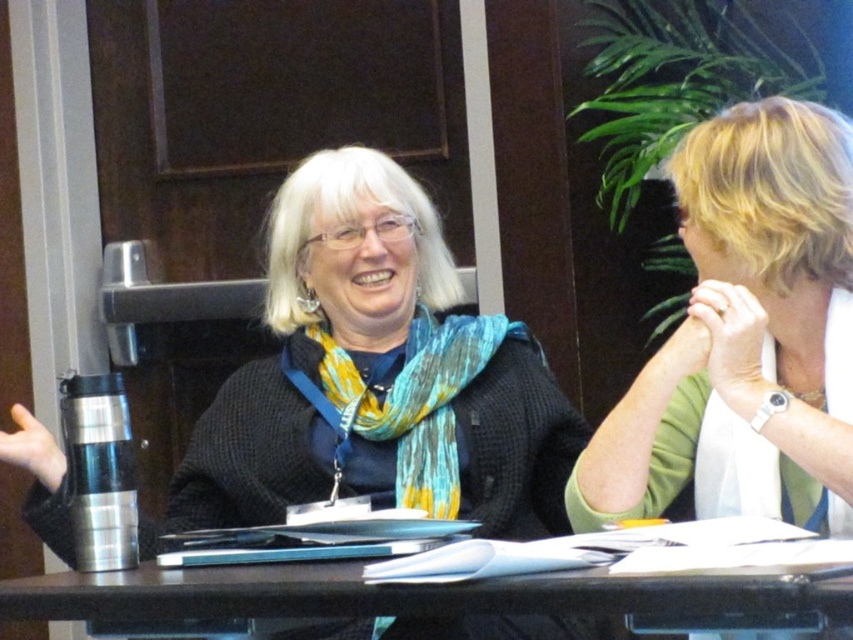
Question: Is black plastic table at center further to camera compared to blue and yellow woven scarf at center?

Choices:
 (A) no
 (B) yes

Answer: (A)

Question: Which object is the closest to the blue and yellow woven scarf at center?

Choices:
 (A) black plastic table at center
 (B) white fabric at upper right

Answer: (B)

Question: Which of the following is the closest to the observer?

Choices:
 (A) blue and yellow woven scarf at center
 (B) white fabric at upper right
 (C) black plastic table at center

Answer: (C)

Question: Can you confirm if white fabric at upper right is smaller than blue and yellow woven scarf at center?

Choices:
 (A) yes
 (B) no

Answer: (B)

Question: Which object is positioned farthest from the blue and yellow woven scarf at center?

Choices:
 (A) white fabric at upper right
 (B) black plastic table at center

Answer: (B)

Question: From the image, what is the correct spatial relationship of white fabric at upper right in relation to blue and yellow woven scarf at center?

Choices:
 (A) above
 (B) below

Answer: (A)